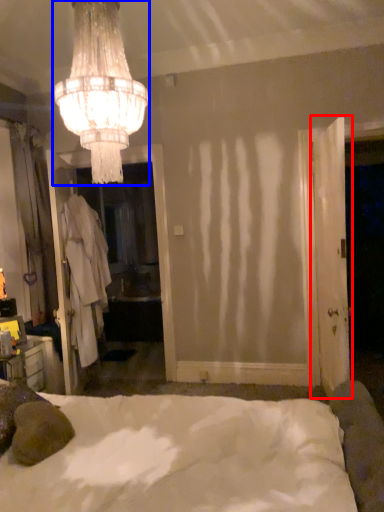
Question: Among these objects, which one is farthest to the camera, door (highlighted by a red box) or lamp (highlighted by a blue box)?

Choices:
 (A) door
 (B) lamp

Answer: (A)